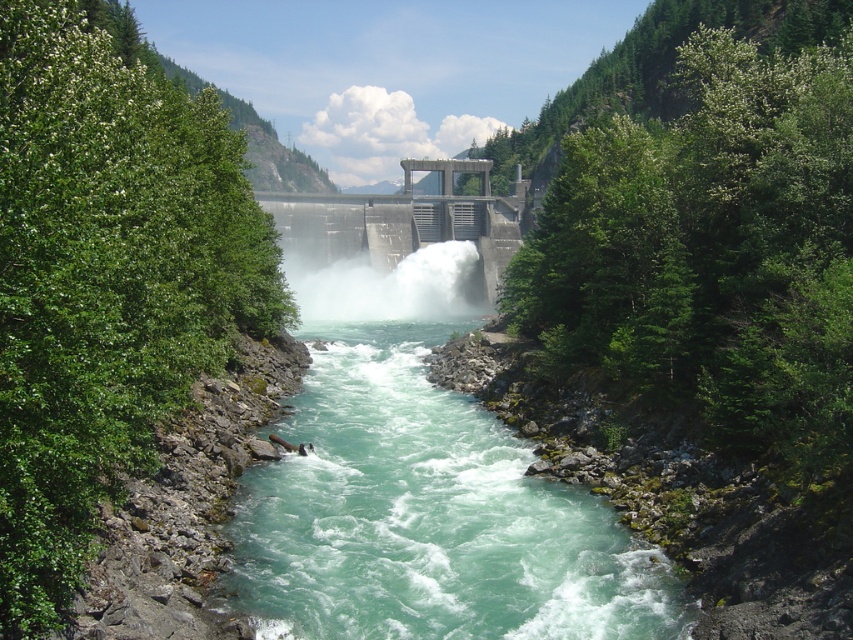
Is point (461, 440) less distant than point (492, 301)?

Yes, it is.

Between point (367, 470) and point (474, 240), which one is positioned in front?

Point (367, 470)

This screenshot has height=640, width=853. Find the location of `turquoise water at center`. turquoise water at center is located at coordinates (427, 515).

Based on the photo, is turquoise water at center smaller than white frothy water at center?

Correct, turquoise water at center occupies less space than white frothy water at center.

Consider the image. Which is more to the right, turquoise water at center or white frothy water at center?

turquoise water at center

The image size is (853, 640). In order to click on turquoise water at center in this screenshot , I will do `click(427, 515)`.

Between gray concrete dam at center and white frothy water at center, which one is positioned higher?

gray concrete dam at center is above.

What do you see at coordinates (405, 221) in the screenshot? The height and width of the screenshot is (640, 853). I see `gray concrete dam at center` at bounding box center [405, 221].

Find the location of a particular element. This screenshot has width=853, height=640. gray concrete dam at center is located at coordinates (405, 221).

What are the coordinates of `gray concrete dam at center` in the screenshot? It's located at click(x=405, y=221).